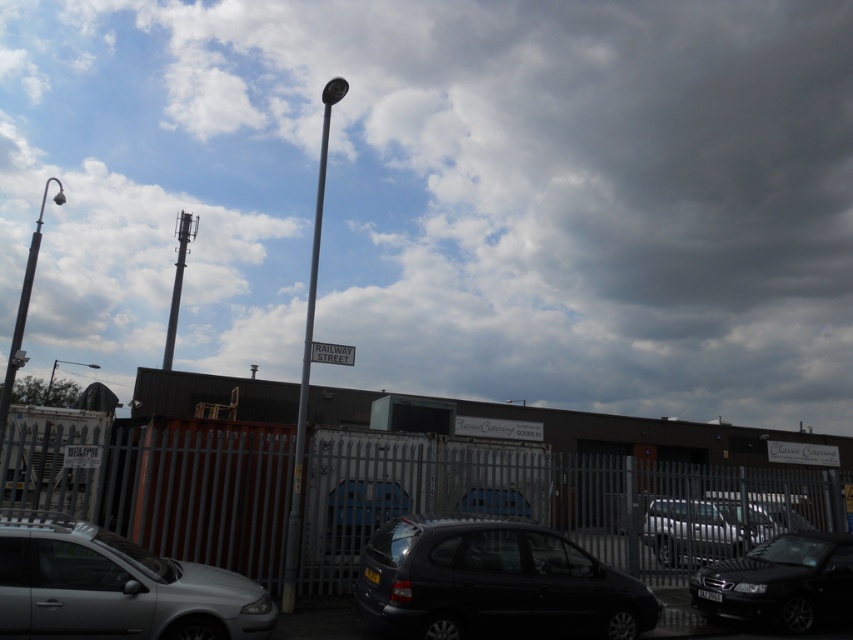
Question: Which point appears farthest from the camera in this image?

Choices:
 (A) (618, 632)
 (B) (88, 177)
 (C) (173, 321)

Answer: (B)

Question: Which point is farther to the camera?

Choices:
 (A) (831, 580)
 (B) (177, 230)
 (C) (328, 195)

Answer: (C)

Question: Is the position of cloudy sky at upper center more distant than that of black glossy car at lower right?

Choices:
 (A) yes
 (B) no

Answer: (A)

Question: Is silver metallic car at lower left above metallic pole at upper center?

Choices:
 (A) no
 (B) yes

Answer: (A)

Question: Which is nearer to the matte black car at center?

Choices:
 (A) black glossy car at lower right
 (B) white plastic street sign at center
 (C) cloudy sky at upper center

Answer: (A)

Question: Is metallic gray fence at center thinner than metallic pole at left?

Choices:
 (A) no
 (B) yes

Answer: (B)